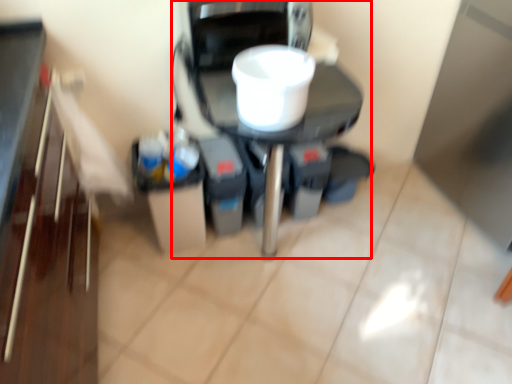
Question: In this image, where is appliance (annotated by the red box) located relative to appliance?

Choices:
 (A) right
 (B) left

Answer: (B)